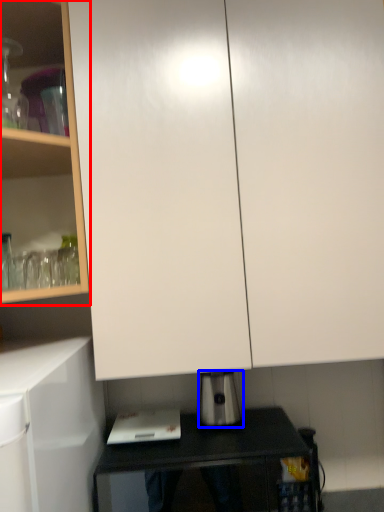
Question: Which point is closer to the camera, cabinetry (highlighted by a red box) or kitchen appliance (highlighted by a blue box)?

Choices:
 (A) cabinetry
 (B) kitchen appliance

Answer: (A)